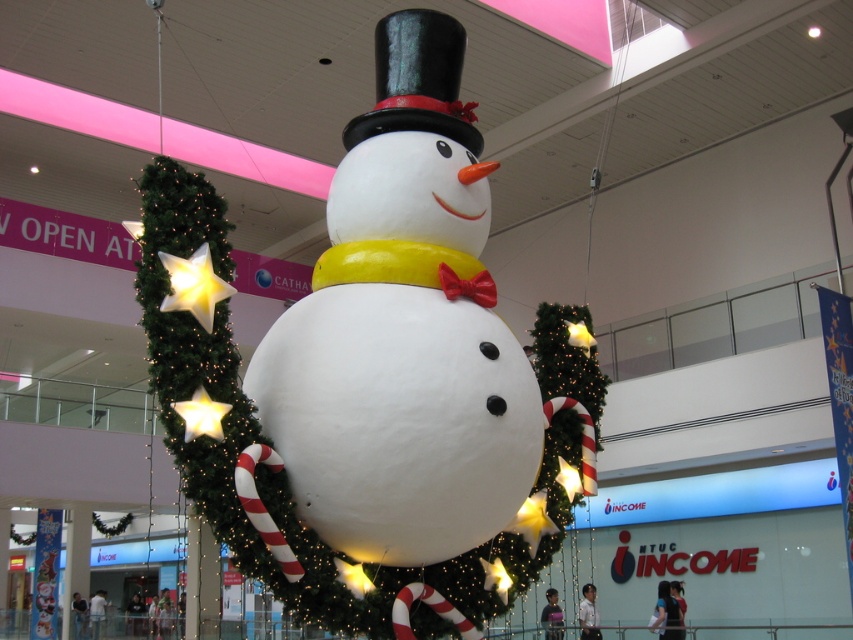
You are a store manager who wants to place a new holiday decoration between the white matte snowman at center and the shiny black hat at upper center. Given their sizes, which object should you consider moving to accommodate the new decoration?

The white matte snowman at center is wider than the shiny black hat at upper center. To accommodate the new decoration, you should consider moving the white matte snowman at center since it occupies more space.

You are standing in the holiday decoration area and see two points marked in the scene. Which point is closer to you, point [560,339] or point [436,52]?

Point [560,339] is further to the viewer than point [436,52], so point [436,52] is closer to you.

You are a photographer setting up a shot of the holiday decorations. You notice the white matte snowman at center and the shiny black hat at upper center. Which object is located to the right of the other?

The white matte snowman at center is positioned on the right side of shiny black hat at upper center, so the snowman is to the right of the hat.